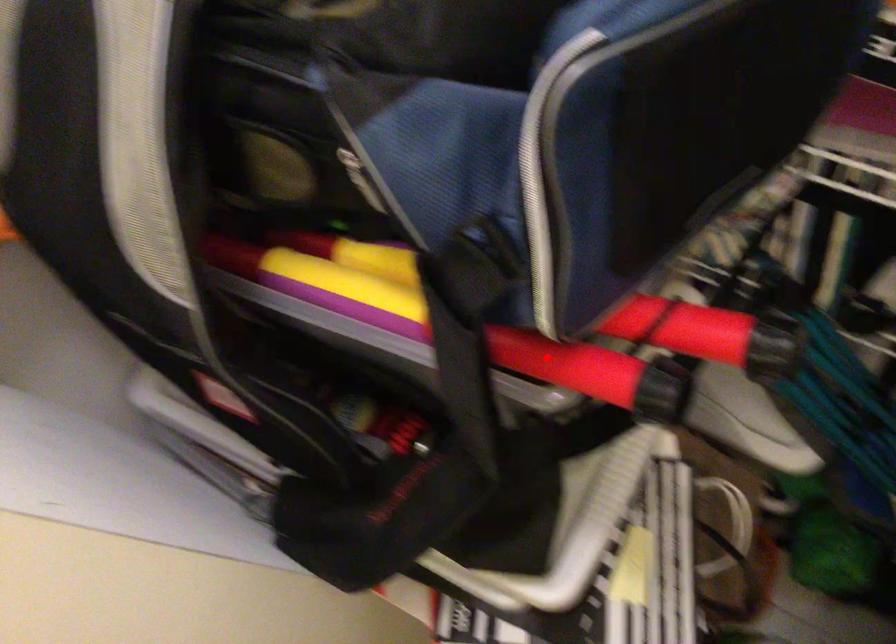
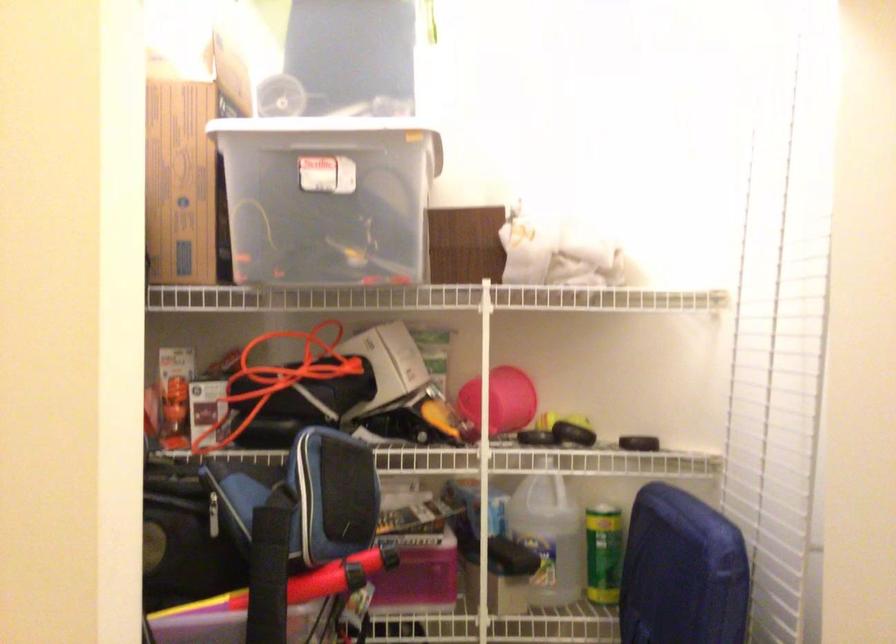
The point at the highlighted location is marked in the first image. Where is the corresponding point in the second image?

(298, 583)